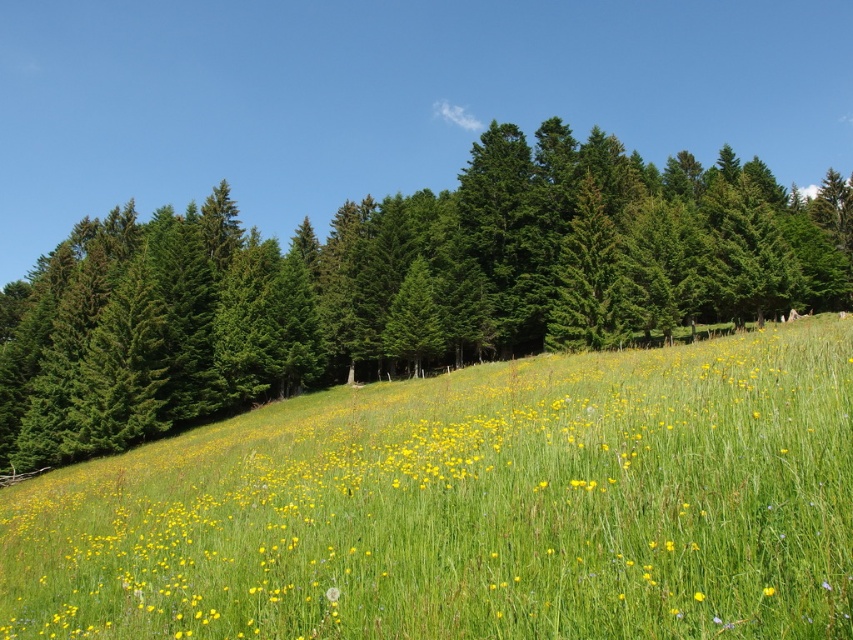
You are standing in the meadow and want to take a photo of both the green textured pine forest at upper center and the yellow matte flower at center. Which object should you zoom in on to ensure both fit in the frame?

Since the green textured pine forest at upper center is wider than the yellow matte flower at center, you should zoom out to capture both objects in the frame.

You are an artist planning to paint this landscape. You want to ensure the green textured pine forest at upper center and the yellow matte flower at center are proportionally accurate. Which object should you paint first to maintain the correct size relationship between them?

You should paint the green textured pine forest at upper center first because it is bigger than the yellow matte flower at center, so starting with the larger object ensures proper scaling when adding the smaller one.